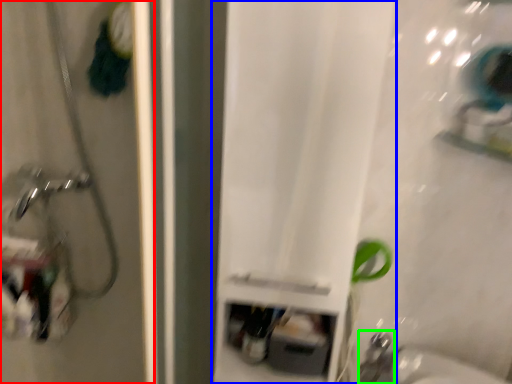
Question: Considering the real-world distances, which object is farthest from screen door (highlighted by a red box)? curtain (highlighted by a blue box) or faucet (highlighted by a green box)?

Choices:
 (A) curtain
 (B) faucet

Answer: (B)